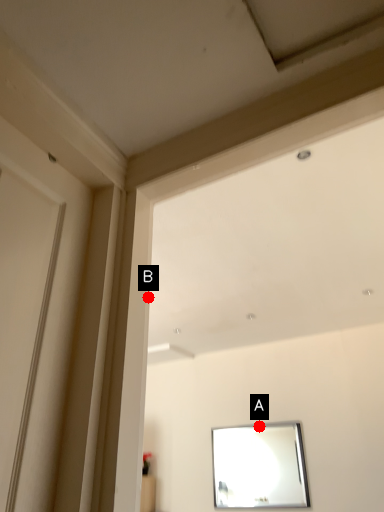
Question: Two points are circled on the image, labeled by A and B beside each circle. Among these points, which one is nearest to the camera?

Choices:
 (A) A is closer
 (B) B is closer

Answer: (B)